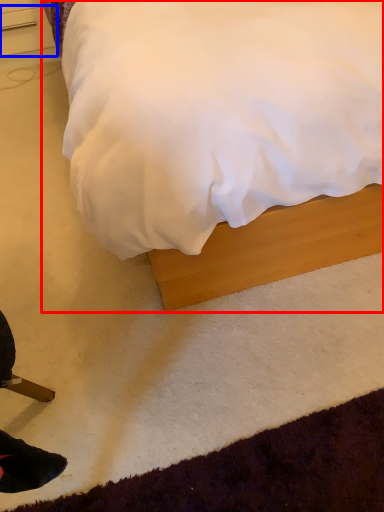
Question: Which object appears closest to the camera in this image, bed (highlighted by a red box) or drawer (highlighted by a blue box)?

Choices:
 (A) bed
 (B) drawer

Answer: (A)